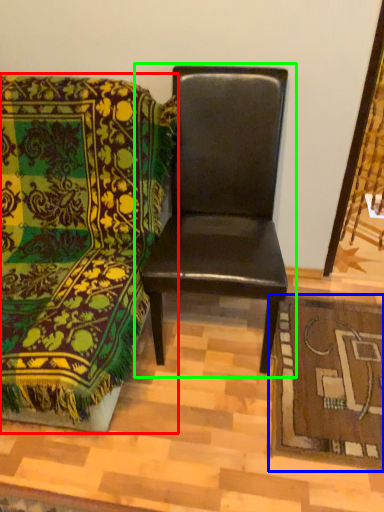
Question: Estimate the real-world distances between objects in this image. Which object is closer to chair (highlighted by a red box), mat (highlighted by a blue box) or chair (highlighted by a green box)?

Choices:
 (A) mat
 (B) chair

Answer: (B)